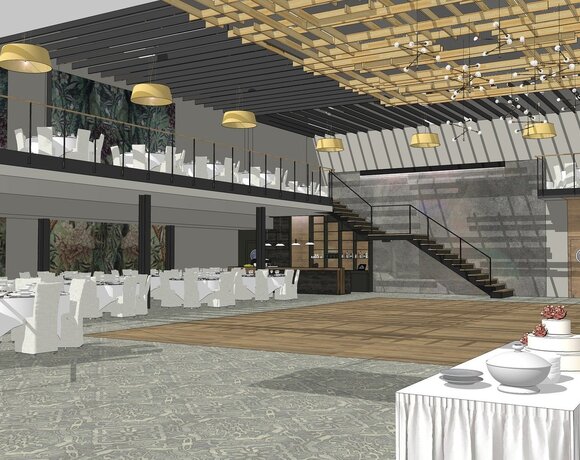
The image size is (580, 460). What are the coordinates of `hanging shades` in the screenshot? It's located at (536, 130), (422, 139), (331, 144), (238, 118), (164, 92), (43, 55).